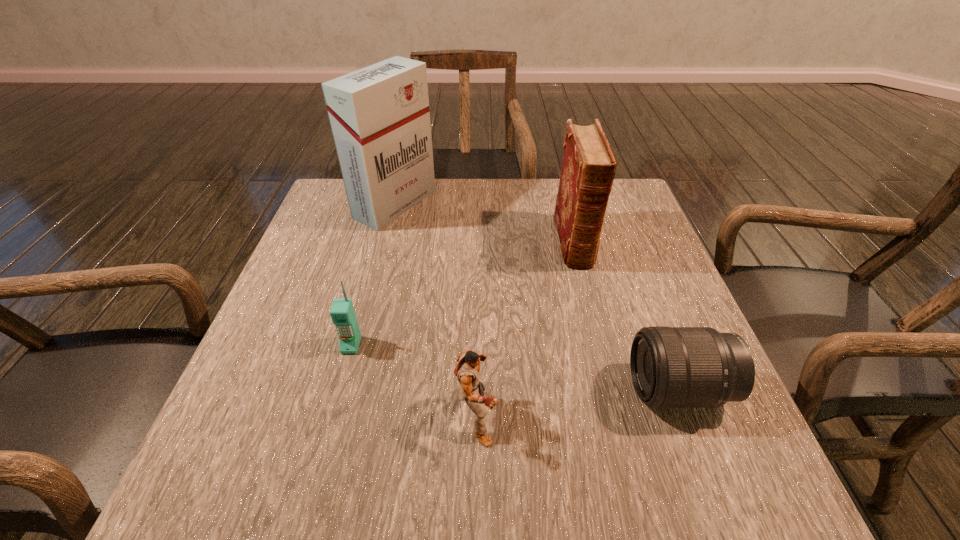
This screenshot has height=540, width=960. In order to click on unoccupied position between the cigarette case and the shortest object in this screenshot , I will do pos(538,297).

What are the coordinates of `free area in between the rightmost object and the cigarette case` in the screenshot? It's located at (538, 297).

You are a GUI agent. You are given a task and a screenshot of the screen. Output one action in this format:
    pyautogui.click(x=<x>, y=<y>)
    Task: Click on the free spot between the telephoto lens and the tallest object
    
    Given the screenshot: What is the action you would take?
    pyautogui.click(x=538, y=297)

At what (x,y) coordinates should I click in order to perform the action: click on vacant area that lies between the rightmost object and the cigarette case. Please return your answer as a coordinate pair (x, y). Looking at the image, I should click on (538, 297).

I want to click on free space between the cigarette case and the second tallest object, so click(485, 223).

Identify the location of object identified as the fourth closest to the third object from right to left. The width and height of the screenshot is (960, 540). (379, 115).

Identify which object is located as the second nearest to the telephoto lens. Please provide its 2D coordinates. Your answer should be formatted as a tuple, i.e. [(x, y)], where the tuple contains the x and y coordinates of a point satisfying the conditions above.

[(588, 167)]